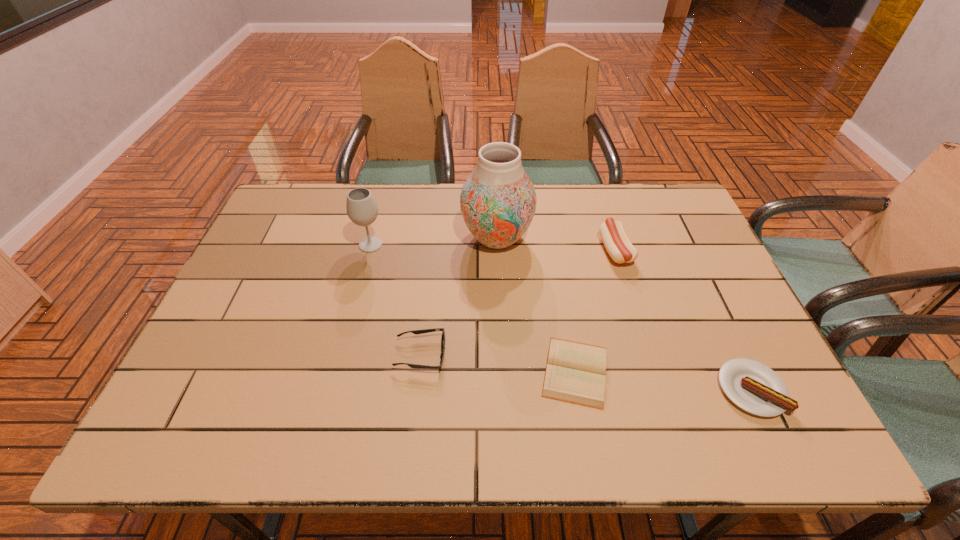
The image size is (960, 540). What are the coordinates of `vacant area that lies between the diary and the sunglasses` in the screenshot? It's located at (498, 363).

Locate an element on the screen. The image size is (960, 540). blank region between the sunglasses and the farther sausage is located at coordinates (518, 302).

You are a GUI agent. You are given a task and a screenshot of the screen. Output one action in this format:
    pyautogui.click(x=<x>, y=<y>)
    Task: Click on the vacant space in between the sunglasses and the wineglass
    The width and height of the screenshot is (960, 540).
    Given the screenshot: What is the action you would take?
    pyautogui.click(x=396, y=300)

Locate an element on the screen. This screenshot has height=540, width=960. the fourth closest object to the fifth object from left to right is located at coordinates (416, 332).

Identify the location of object identified as the fourth closest to the shortest object. (498, 201).

The width and height of the screenshot is (960, 540). In order to click on free space in the image that satisfies the following two spatial constraints: 1. on the front side of the tallest object; 2. on the right side of the shortest object in this screenshot , I will do `click(502, 372)`.

Locate an element on the screen. Image resolution: width=960 pixels, height=540 pixels. vacant point that satisfies the following two spatial constraints: 1. on the front side of the left sausage; 2. on the left side of the wineglass is located at coordinates (370, 250).

What are the coordinates of `free space that satisfies the following two spatial constraints: 1. on the front side of the taller sausage; 2. on the left side of the vase` in the screenshot? It's located at (497, 250).

The image size is (960, 540). I want to click on vacant space that satisfies the following two spatial constraints: 1. on the back side of the shortest object; 2. on the front-facing side of the second object from left to right, so click(572, 355).

The image size is (960, 540). In order to click on free spot that satisfies the following two spatial constraints: 1. on the back side of the diary; 2. on the front-facing side of the sunglasses in this screenshot , I will do `click(572, 355)`.